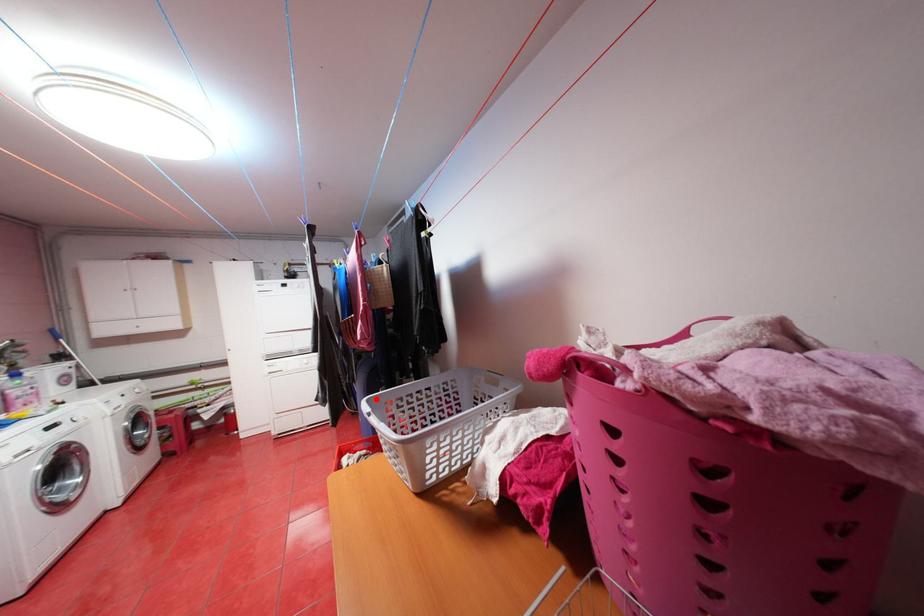
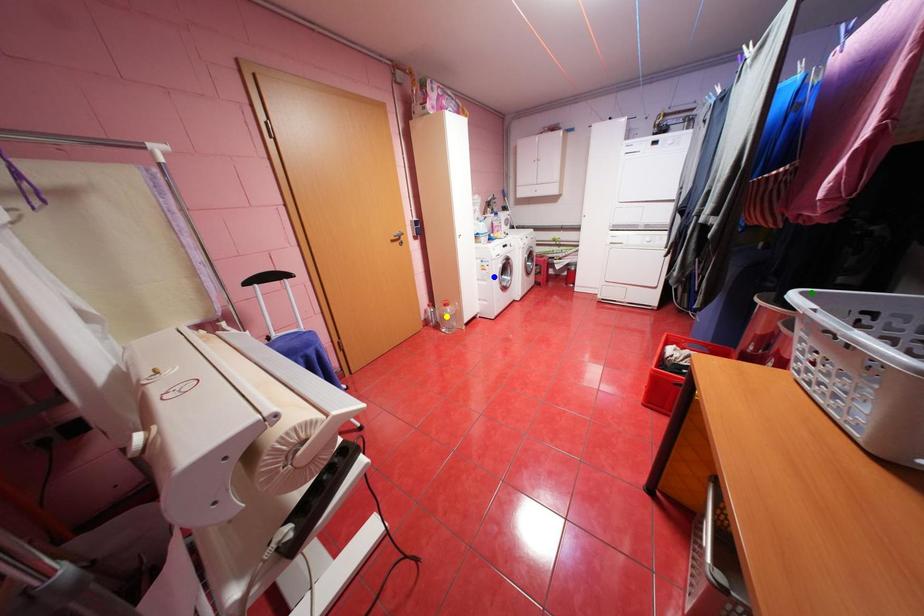
Question: I am providing you with two images of the same scene from different viewpoints. A red point is marked on the first image. You are given multiple points on the second image. Which point in image 2 is actually the same real-world point as the red point in image 1?

Choices:
 (A) yellow point
 (B) green point
 (C) blue point

Answer: (B)